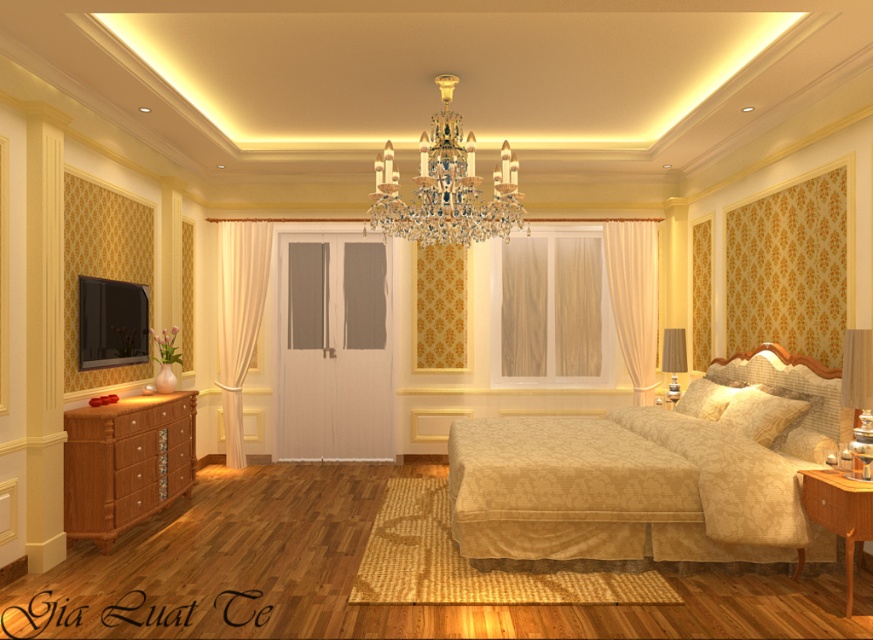
Question: Which of the following is the farthest from the observer?

Choices:
 (A) (856, 342)
 (B) (748, 442)

Answer: (B)

Question: Considering the real-world distances, which object is closest to the matte glass lampshade at right?

Choices:
 (A) beige fabric bed at center
 (B) beige textured pillow at right
 (C) wooden dresser at left
 (D) crystal gold chandelier at center

Answer: (B)

Question: Does white sheer curtain at right have a smaller size compared to matte glass lampshade at right?

Choices:
 (A) yes
 (B) no

Answer: (B)

Question: Is light brown wooden nightstand at lower right to the left of matte glass lampshade at right from the viewer's perspective?

Choices:
 (A) yes
 (B) no

Answer: (A)

Question: Can you confirm if crystal gold chandelier at center is bigger than matte glass lampshade at right?

Choices:
 (A) no
 (B) yes

Answer: (B)

Question: Estimate the real-world distances between objects in this image. Which object is farther from the beige fabric bed at center?

Choices:
 (A) light brown wooden nightstand at lower right
 (B) satin beige pillow at center
 (C) crystal gold chandelier at center

Answer: (C)